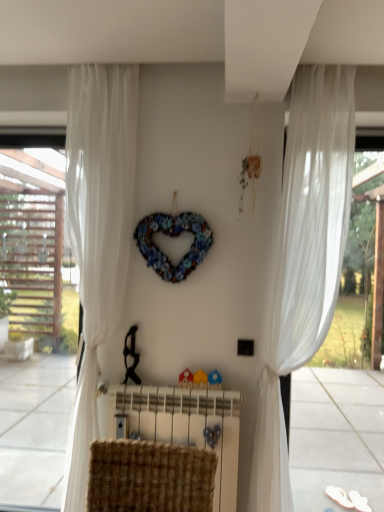
Question: Considering the positions of white sheer curtain at right, the first curtain when ordered from right to left, and white sheer curtain at right in the image, is white sheer curtain at right, the first curtain when ordered from right to left, wider or thinner than white sheer curtain at right?

Choices:
 (A) wide
 (B) thin

Answer: (A)

Question: Is point (306, 245) positioned closer to the camera than point (332, 333)?

Choices:
 (A) closer
 (B) farther

Answer: (A)

Question: Which object is positioned closest to the white sheer curtain at right, which is the 2th curtain in left-to-right order?

Choices:
 (A) white sheer curtain at right
 (B) multicolored fabric heart at center
 (C) woven fabric radiator at center
 (D) white sheer curtain at left, positioned as the second curtain in right-to-left order

Answer: (A)

Question: Which object is the farthest from the multicolored fabric heart at center?

Choices:
 (A) white sheer curtain at right
 (B) white sheer curtain at right, which is the 2th curtain in left-to-right order
 (C) white sheer curtain at left, positioned as the second curtain in right-to-left order
 (D) woven fabric radiator at center

Answer: (A)